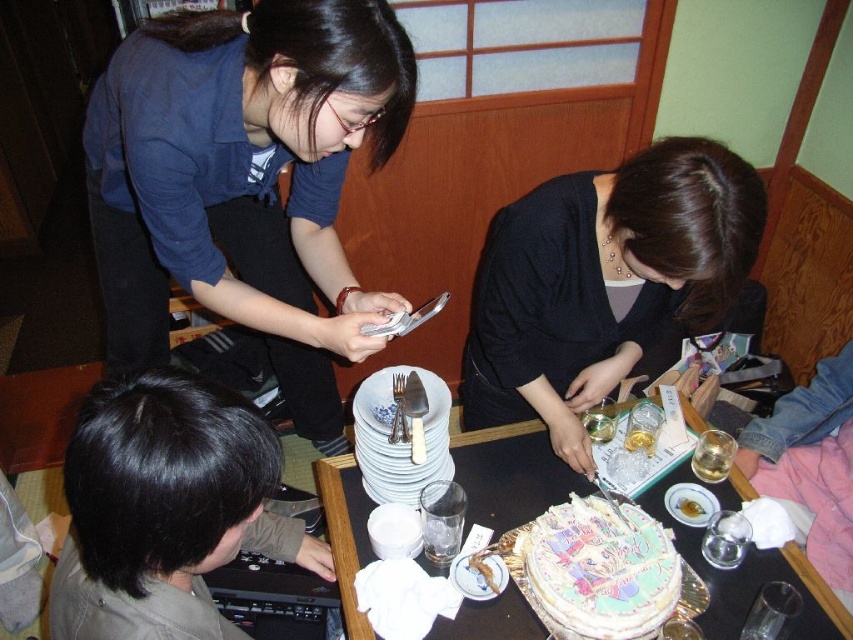
Is white ceramic plate at center positioned before white paper plate at center?

No, white ceramic plate at center is behind white paper plate at center.

Can you confirm if white ceramic plate at center is bigger than white paper plate at center?

Correct, white ceramic plate at center is larger in size than white paper plate at center.

The height and width of the screenshot is (640, 853). What do you see at coordinates (689, 502) in the screenshot? I see `white ceramic plate at center` at bounding box center [689, 502].

Locate an element on the screen. Image resolution: width=853 pixels, height=640 pixels. white ceramic plate at center is located at coordinates (689, 502).

Which is more to the left, white frosted cake at center or decorative paper cake at center?

Positioned to the left is white frosted cake at center.

Between point (538, 451) and point (662, 573), which one is positioned behind?

Point (538, 451)

You are a GUI agent. You are given a task and a screenshot of the screen. Output one action in this format:
    pyautogui.click(x=<x>, y=<y>)
    Task: Click on the white frosted cake at center
    The height and width of the screenshot is (640, 853).
    Given the screenshot: What is the action you would take?
    pyautogui.click(x=509, y=474)

Consider the image. Is matte blue shirt at upper left shorter than matte black sweater at center?

No, matte blue shirt at upper left is not shorter than matte black sweater at center.

Based on the photo, does matte blue shirt at upper left have a smaller size compared to matte black sweater at center?

Actually, matte blue shirt at upper left might be larger than matte black sweater at center.

Looking at this image, who is more forward, (x=109, y=321) or (x=509, y=336)?

Point (x=509, y=336)

Image resolution: width=853 pixels, height=640 pixels. I want to click on matte blue shirt at upper left, so click(244, 180).